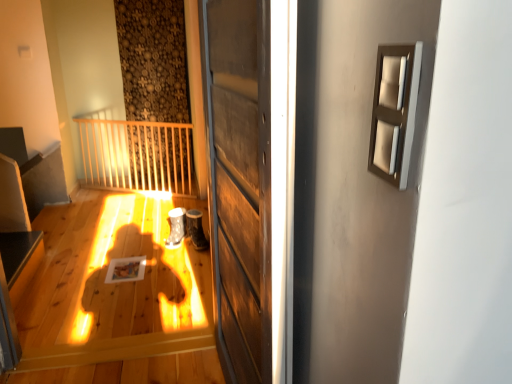
Question: Is the position of wooden door at center less distant than that of smooth black surface at lower left?

Choices:
 (A) yes
 (B) no

Answer: (A)

Question: Is wooden door at center shorter than smooth black surface at lower left?

Choices:
 (A) yes
 (B) no

Answer: (B)

Question: From a real-world perspective, is wooden door at center located beneath smooth black surface at lower left?

Choices:
 (A) yes
 (B) no

Answer: (B)

Question: Can you confirm if wooden door at center is thinner than smooth black surface at lower left?

Choices:
 (A) no
 (B) yes

Answer: (B)

Question: Can you confirm if wooden door at center is positioned to the left of smooth black surface at lower left?

Choices:
 (A) no
 (B) yes

Answer: (A)

Question: Is there a large distance between wooden door at center and smooth black surface at lower left?

Choices:
 (A) no
 (B) yes

Answer: (B)

Question: From the image's perspective, would you say wooden door at center is positioned over satin beige frame at upper right?

Choices:
 (A) yes
 (B) no

Answer: (B)

Question: Is wooden door at center wider than satin beige frame at upper right?

Choices:
 (A) no
 (B) yes

Answer: (B)

Question: Is wooden door at center bigger than satin beige frame at upper right?

Choices:
 (A) yes
 (B) no

Answer: (A)

Question: Can you confirm if wooden door at center is smaller than satin beige frame at upper right?

Choices:
 (A) yes
 (B) no

Answer: (B)

Question: Is wooden door at center touching satin beige frame at upper right?

Choices:
 (A) yes
 (B) no

Answer: (B)

Question: From a real-world perspective, is wooden door at center physically above satin beige frame at upper right?

Choices:
 (A) no
 (B) yes

Answer: (A)

Question: Is smooth black surface at lower left positioned with its back to satin beige frame at upper right?

Choices:
 (A) yes
 (B) no

Answer: (B)